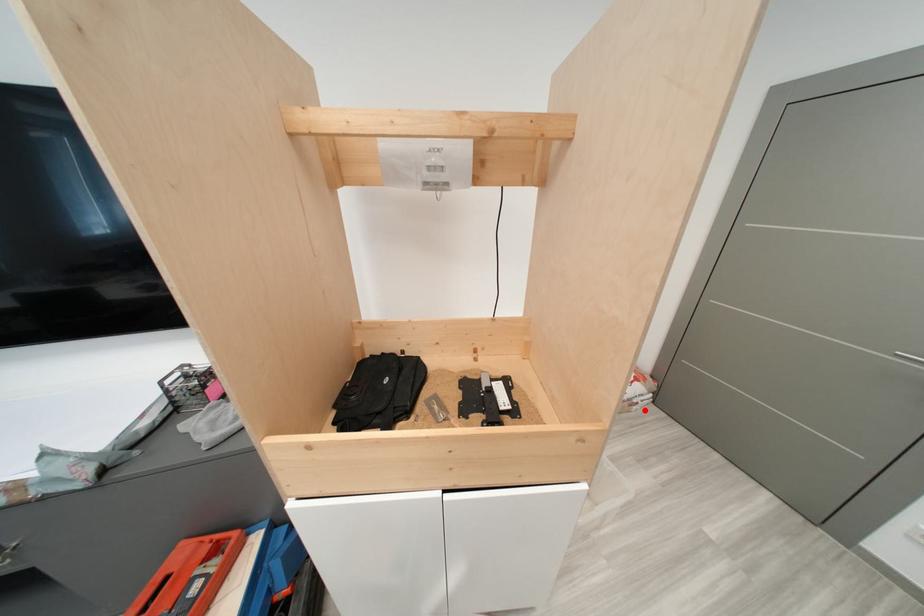
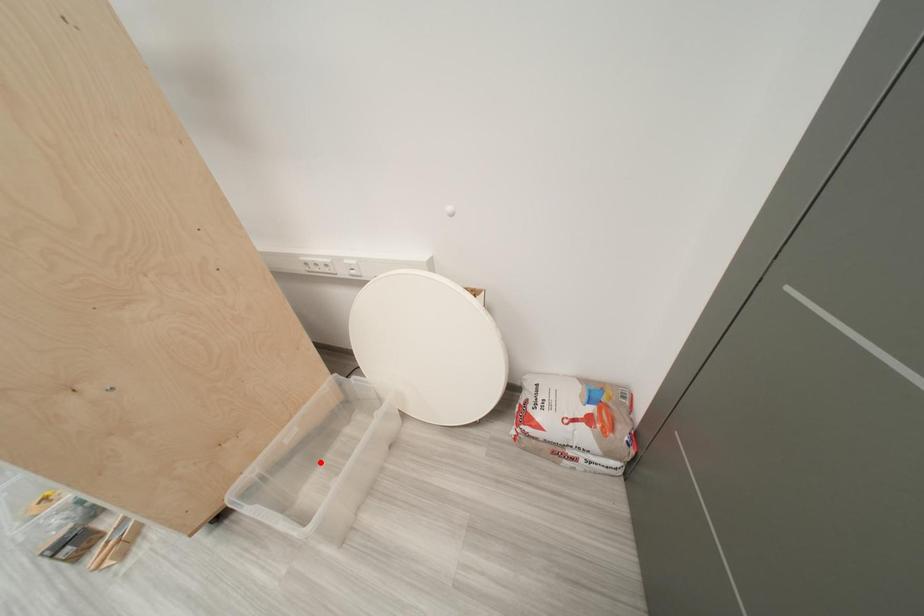
I am providing you with two images of the same scene from different viewpoints. A red point is marked on the first image and another point is marked on the second image. Does the point marked in image1 correspond to the same location as the one in image2?

No